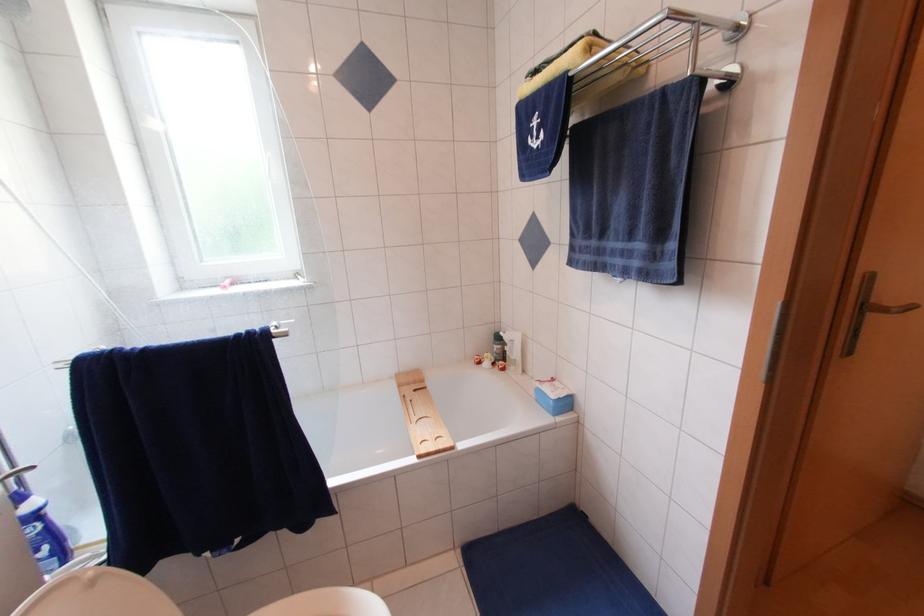
Identify the location of white pump dispenser. (513, 350).